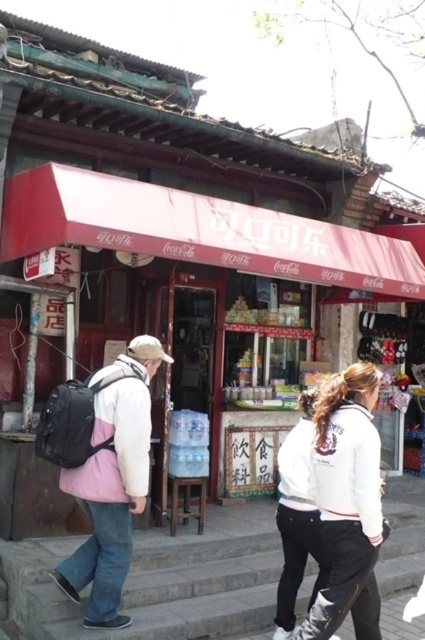
Question: Which point is farther to the camera?

Choices:
 (A) click(x=136, y=486)
 (B) click(x=342, y=476)
 (C) click(x=187, y=634)
 (D) click(x=95, y=440)

Answer: (C)

Question: Is white fleece jacket at center positioned behind light pink fabric jacket at left?

Choices:
 (A) no
 (B) yes

Answer: (A)

Question: Can you confirm if gray concrete steps at lower center is positioned to the right of white fleece jacket at center?

Choices:
 (A) no
 (B) yes

Answer: (A)

Question: Which of the following is the closest to the observer?

Choices:
 (A) (359, 634)
 (B) (163, 353)
 (C) (411, 561)
 (D) (84, 484)

Answer: (A)

Question: Is gray concrete steps at lower center wider than light pink fabric jacket at left?

Choices:
 (A) no
 (B) yes

Answer: (B)

Question: Which of the following is the closest to the observer?

Choices:
 (A) light pink fabric jacket at left
 (B) white fleece jacket at center
 (C) gray concrete steps at lower center

Answer: (B)